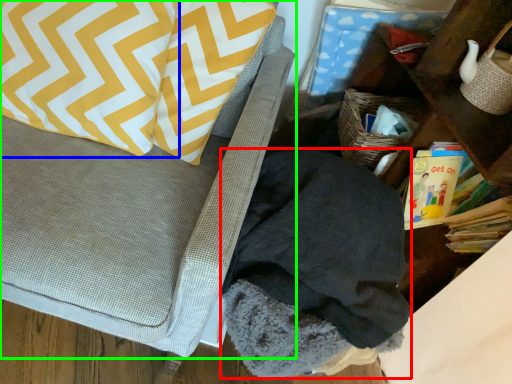
Question: Considering the real-world distances, which object is farthest from clothing (highlighted by a red box)? pillow (highlighted by a blue box) or furniture (highlighted by a green box)?

Choices:
 (A) pillow
 (B) furniture

Answer: (A)